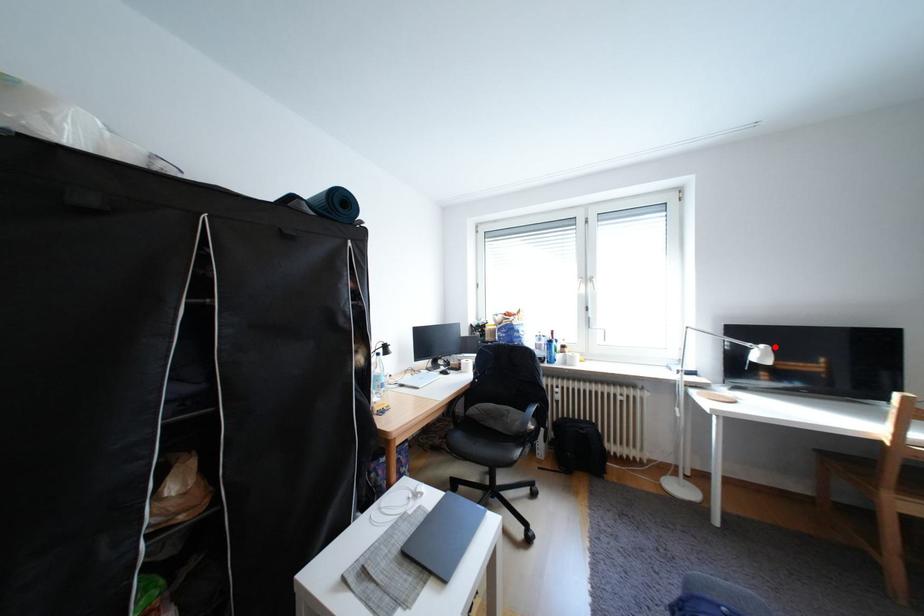
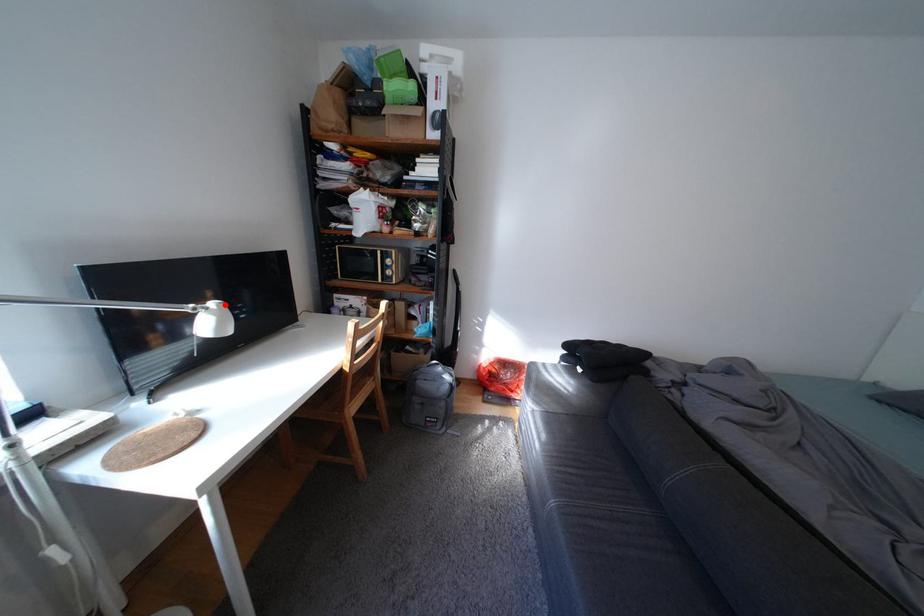
I am providing you with two images of the same scene from different viewpoints. A red point is marked on the first image and another point is marked on the second image. Do the highlighted points in image1 and image2 indicate the same real-world spot?

Yes